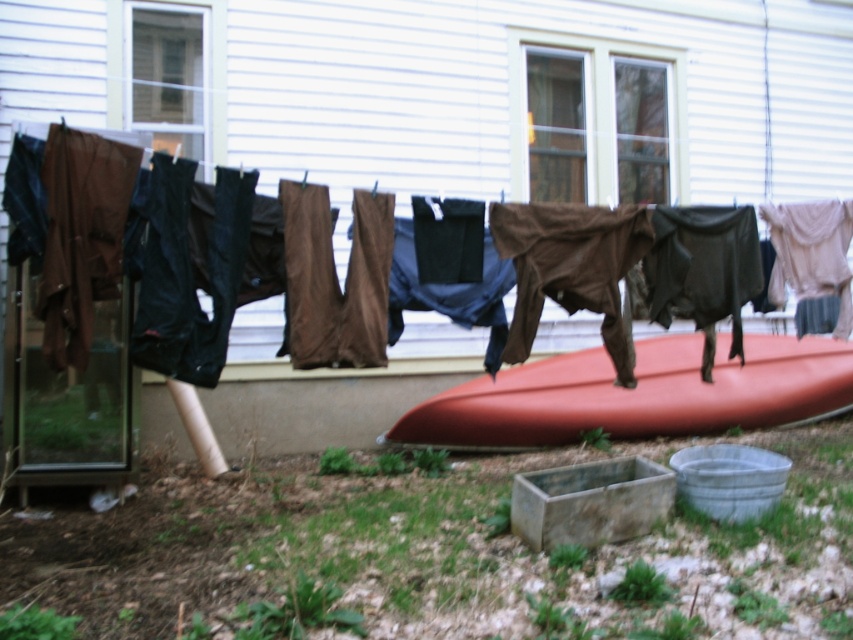
You are standing in the outdoor area where the clothesline is located. You need to retrieve the matte brown pants at center to fold them. Which direction should you move relative to your current position to reach them?

The matte brown pants at center are located at the central position on the clothesline, so you should move towards the center of the clothesline to retrieve them.

You are planning to hang your new pair of matte orange kayak at center on the clothesline. Currently, there is a matte brown pants at center hanging there. Which object takes up more space on the clothesline?

The matte brown pants at center takes up more space on the clothesline because it is bigger than the matte orange kayak at center.